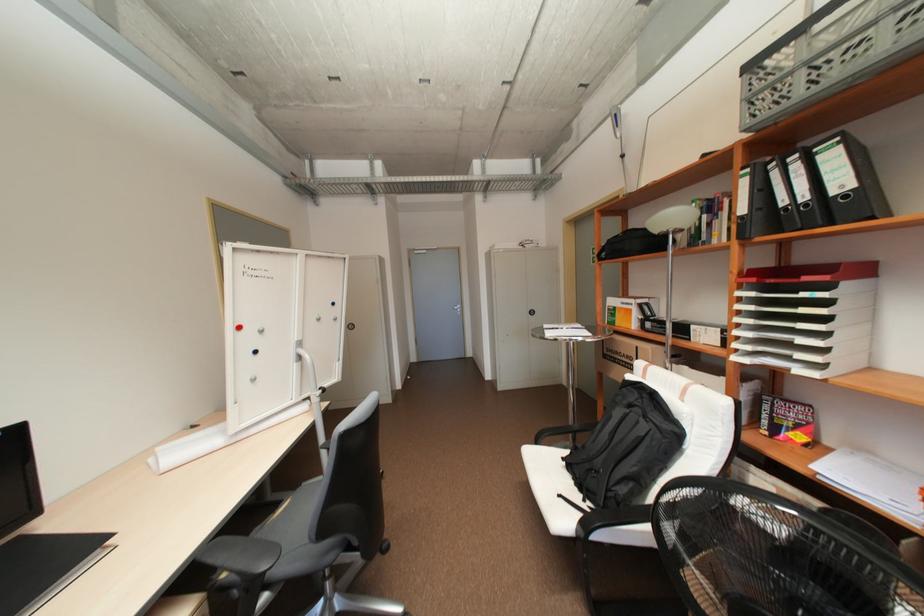
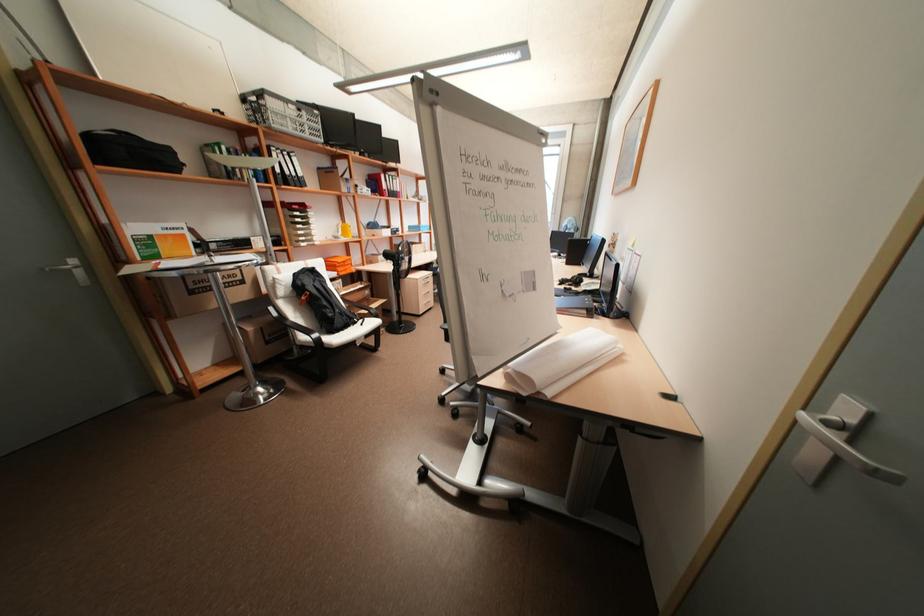
Where in the second image is the point corresponding to point 621,307 from the first image?

(155, 236)